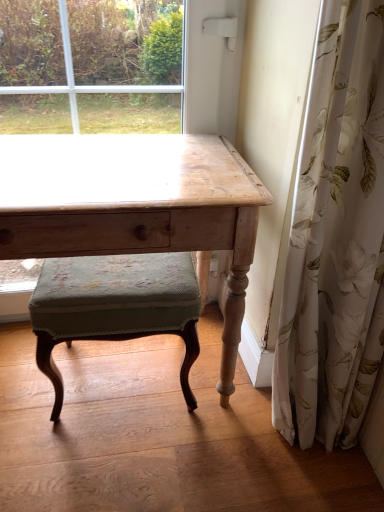
This screenshot has height=512, width=384. What are the coordinates of `free space to the left of white floral fabric at right` in the screenshot? It's located at (228, 454).